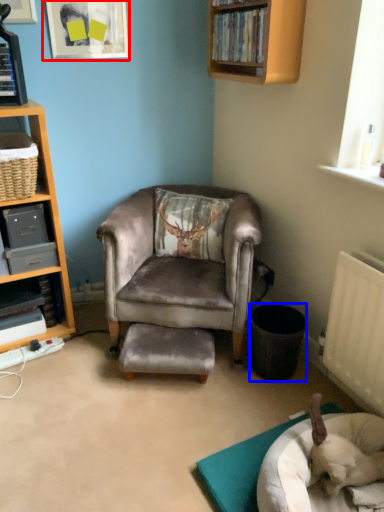
Question: Which of the following is the farthest to the observer, picture frame (highlighted by a red box) or trash bin/can (highlighted by a blue box)?

Choices:
 (A) picture frame
 (B) trash bin/can

Answer: (A)